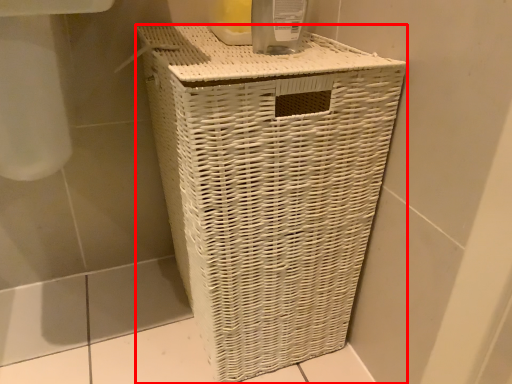
Question: From the image's perspective, what is the correct spatial relationship of waste container (annotated by the red box) in relation to glass jar?

Choices:
 (A) below
 (B) above

Answer: (A)